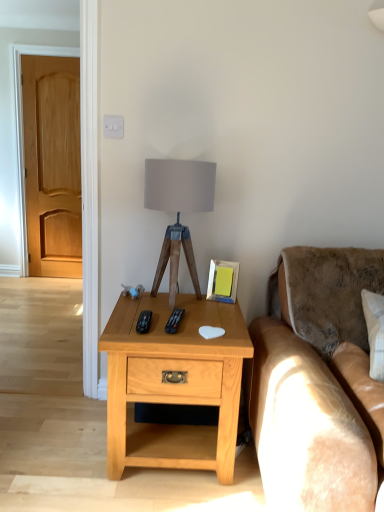
The width and height of the screenshot is (384, 512). In order to click on free space to the left of light brown wood door at left in this screenshot , I will do `click(31, 277)`.